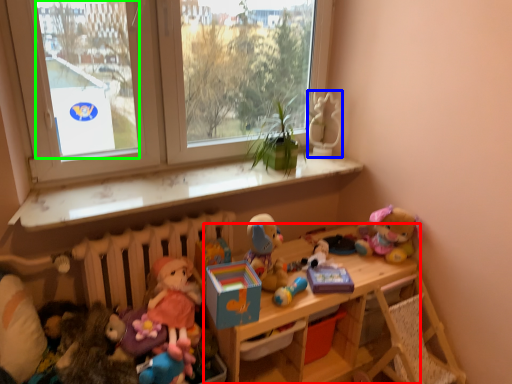
Question: Estimate the real-world distances between objects in this image. Which object is closer to shelf (highlighted by a red box), miniature (highlighted by a blue box) or window screen (highlighted by a green box)?

Choices:
 (A) miniature
 (B) window screen

Answer: (A)